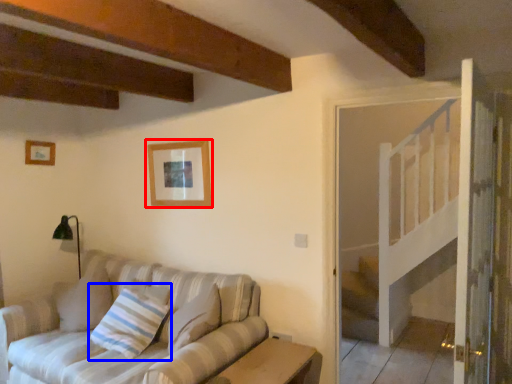
Question: Which object is further to the camera taking this photo, picture frame (highlighted by a red box) or pillow (highlighted by a blue box)?

Choices:
 (A) picture frame
 (B) pillow

Answer: (A)